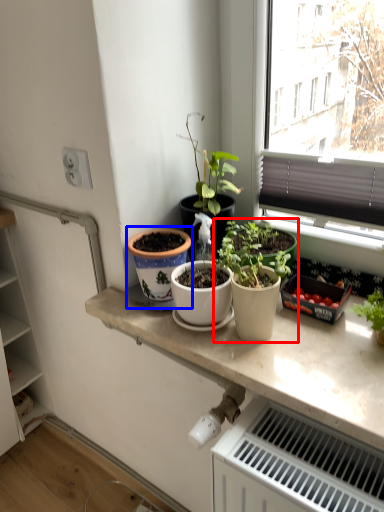
Question: Which object appears closest to the camera in this image, houseplant (highlighted by a red box) or flowerpot (highlighted by a blue box)?

Choices:
 (A) houseplant
 (B) flowerpot

Answer: (A)